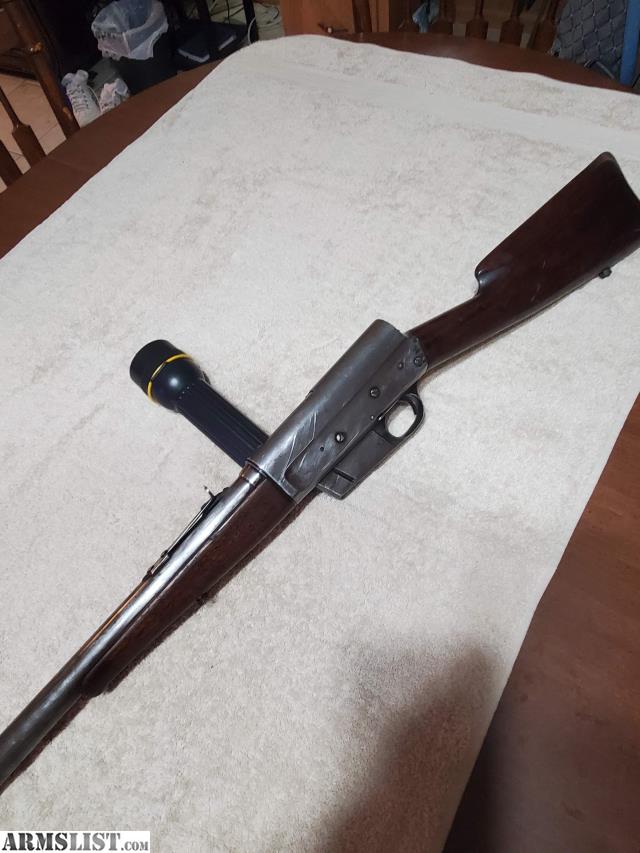
This screenshot has height=853, width=640. I want to click on back seating of chair, so click(60, 90), click(33, 140), click(10, 169), click(480, 32), click(509, 32), click(541, 35), click(435, 26), click(406, 22).